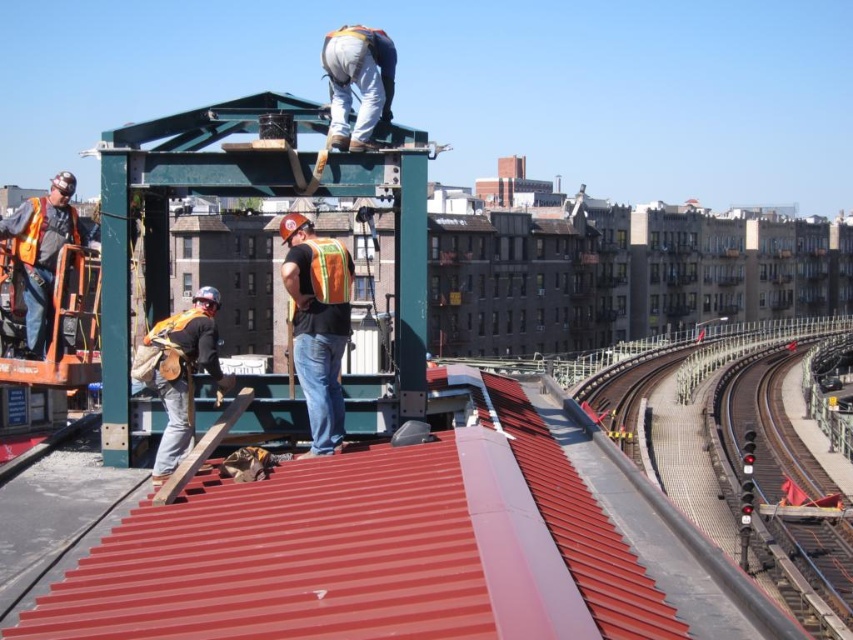
Question: Estimate the real-world distances between objects in this image. Which object is farther from the orange safety vest at center?

Choices:
 (A) orange reflective vest at center
 (B) orange reflective safety vest at left

Answer: (B)

Question: Which object is closer to the camera taking this photo?

Choices:
 (A) smooth metal track at right
 (B) orange reflective vest at center
 (C) orange reflective safety vest at center
 (D) orange reflective safety vest at left

Answer: (B)

Question: Which is nearer to the orange reflective safety vest at left?

Choices:
 (A) smooth metal track at right
 (B) orange reflective safety vest at center

Answer: (B)

Question: Is orange reflective vest at center positioned in front of orange reflective safety vest at left?

Choices:
 (A) no
 (B) yes

Answer: (B)

Question: Is the position of metallic track at right more distant than that of orange reflective safety vest at left?

Choices:
 (A) yes
 (B) no

Answer: (A)

Question: Can you confirm if metallic track at right is thinner than orange safety vest at center?

Choices:
 (A) yes
 (B) no

Answer: (B)